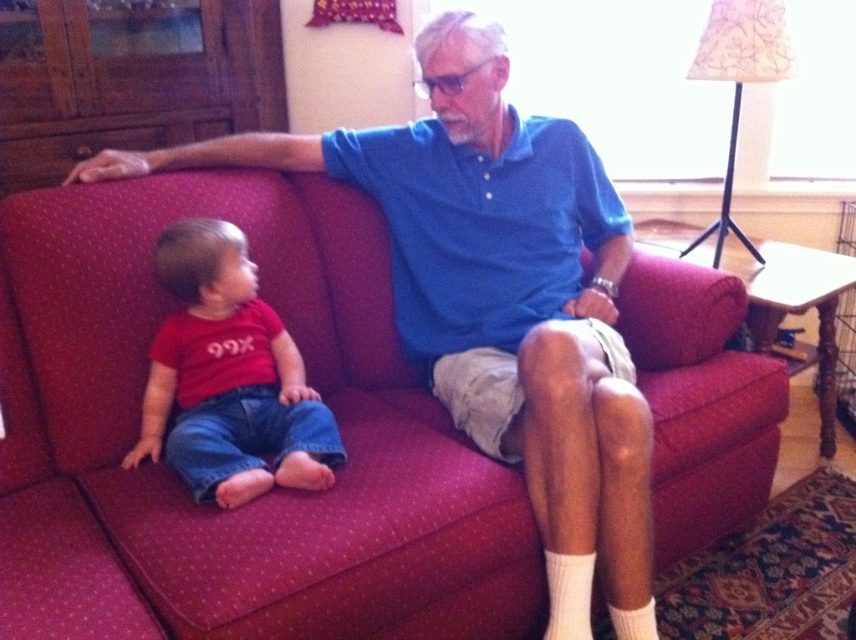
Question: Is matte red shirt at left further to camera compared to white cotton sock at lower right?

Choices:
 (A) no
 (B) yes

Answer: (A)

Question: Among these objects, which one is nearest to the camera?

Choices:
 (A) velvet-like red couch at center
 (B) matte red shirt at left
 (C) white ribbed sock at lower right
 (D) white cotton sock at lower right

Answer: (A)

Question: Which point is farther to the camera?

Choices:
 (A) matte red shirt at left
 (B) white cotton sock at lower right

Answer: (B)

Question: Is velvet-like red couch at center further to camera compared to white cotton sock at lower right?

Choices:
 (A) no
 (B) yes

Answer: (A)

Question: Is velvet-like red couch at center to the right of white cotton sock at lower right from the viewer's perspective?

Choices:
 (A) yes
 (B) no

Answer: (B)

Question: Considering the real-world distances, which object is farthest from the matte red shirt at left?

Choices:
 (A) velvet-like red couch at center
 (B) white ribbed sock at lower right

Answer: (B)